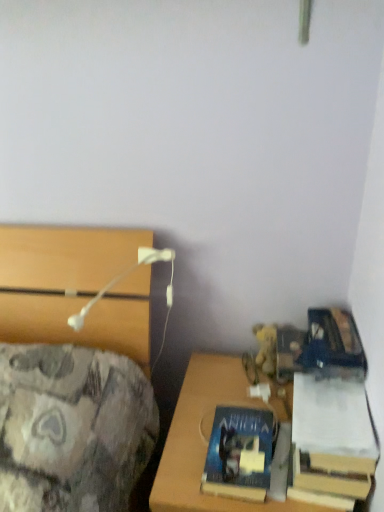
Locate an element on the screen. Image resolution: width=384 pixels, height=512 pixels. vacant space situated on the left part of blue matte book at lower right, which ranks as the 2th book in right-to-left order is located at coordinates (183, 462).